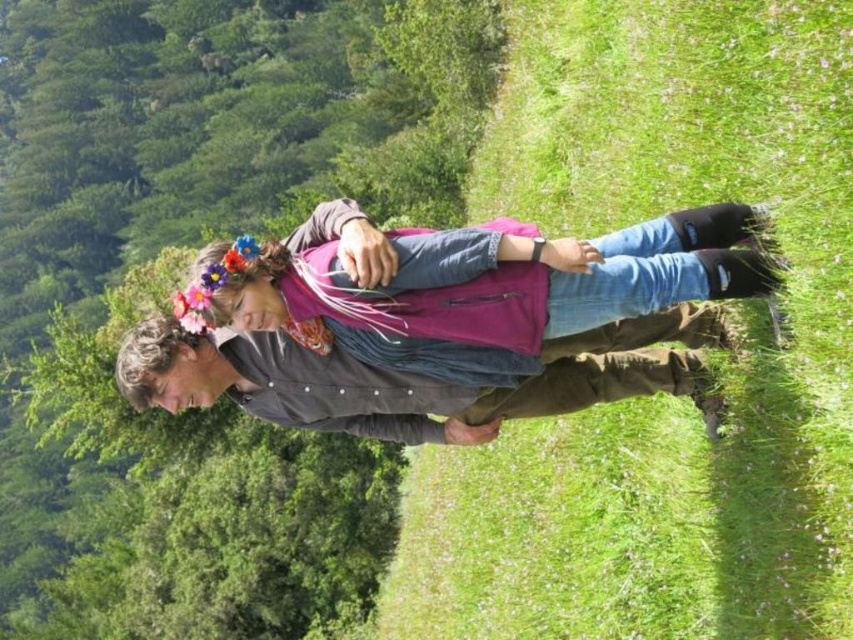
Where is `green grassy field at center`? The image size is (853, 640). green grassy field at center is located at coordinates (660, 396).

Does green grassy field at center have a larger size compared to denim jacket at center?

Indeed, green grassy field at center has a larger size compared to denim jacket at center.

Is point (556, 468) more distant than point (640, 380)?

Yes, it is.

Where is `green grassy field at center`? green grassy field at center is located at coordinates (660, 396).